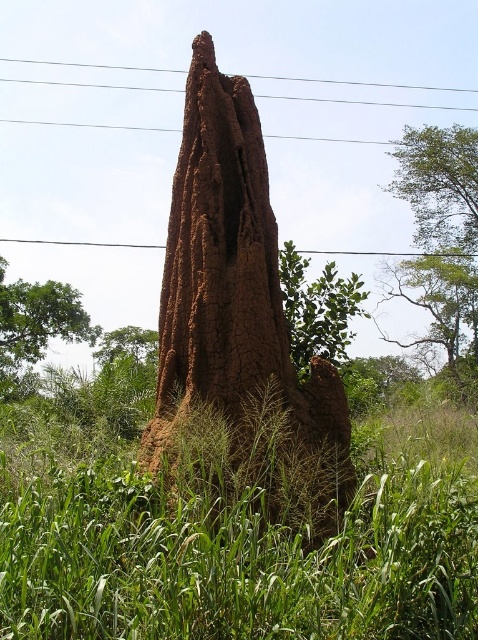
Looking at this image, you are a bird looking for a nesting spot. You see the brown clay termite mound at center and the green leafy tree at upper right. Which one is closer to you?

The brown clay termite mound at center is closer to you because it is in front of the green leafy tree at upper right.

You are standing at the base of the termite mound and want to reach a point in the image. Which of the two points, point (435, 141) or point (333, 348), is closer to you?

Point (333, 348) is closer to you because it is in front of point (435, 141).